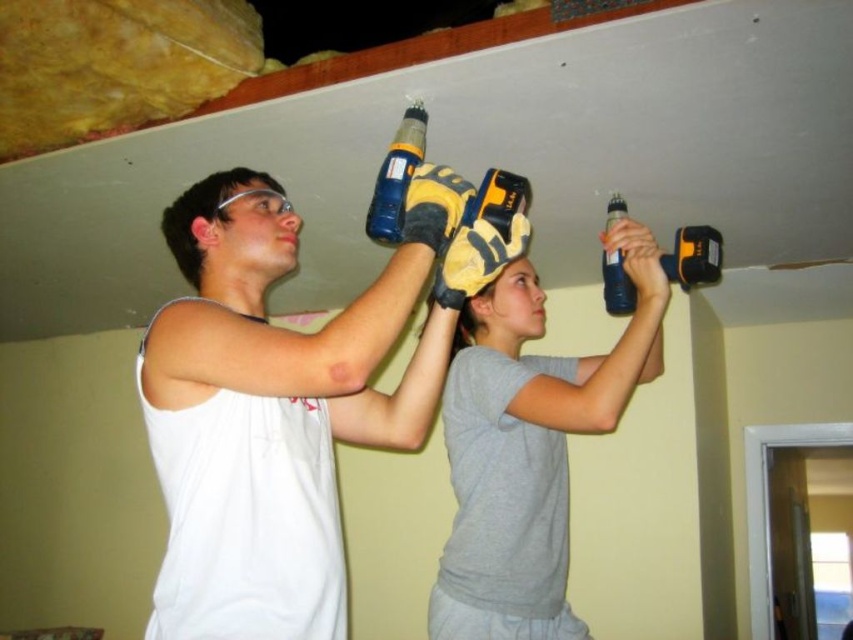
Question: Can you confirm if white matte tank top at center is wider than translucent plastic bottle at upper center?

Choices:
 (A) no
 (B) yes

Answer: (B)

Question: Observing the image, what is the correct spatial positioning of white matte tank top at center in reference to blue plastic drill at upper center?

Choices:
 (A) left
 (B) right

Answer: (A)

Question: Which object appears farthest from the camera in this image?

Choices:
 (A) blue plastic drill at upper center
 (B) translucent plastic bottle at upper center
 (C) white matte tank top at center

Answer: (B)

Question: Among these points, which one is farthest from the camera?

Choices:
 (A) (619, 304)
 (B) (309, 621)
 (C) (395, 228)

Answer: (A)

Question: From the image, what is the correct spatial relationship of gray matte shirt at upper center in relation to blue plastic drill at upper center?

Choices:
 (A) above
 (B) below

Answer: (B)

Question: Which point is farther to the camera?

Choices:
 (A) (630, 294)
 (B) (315, 340)
 (C) (407, 112)
 (D) (700, 276)

Answer: (A)